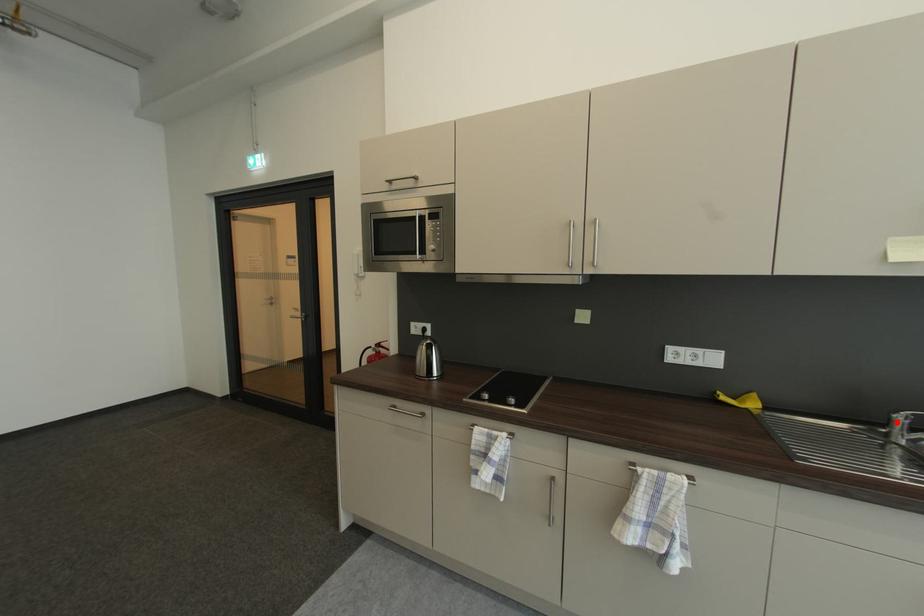
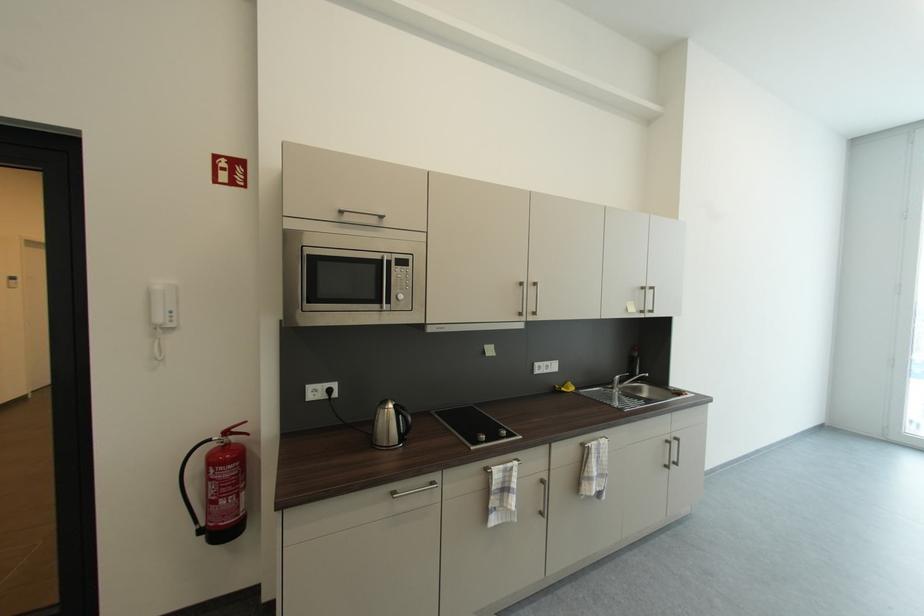
Where in the second image is the point corresponding to the highlighted location from the first image?

(618, 383)